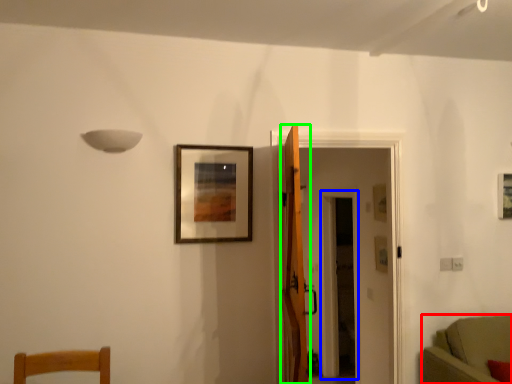
Question: Which object is positioned farthest from furniture (highlighted by a red box)? Select from glass door (highlighted by a blue box) and door (highlighted by a green box).

Choices:
 (A) glass door
 (B) door

Answer: (A)